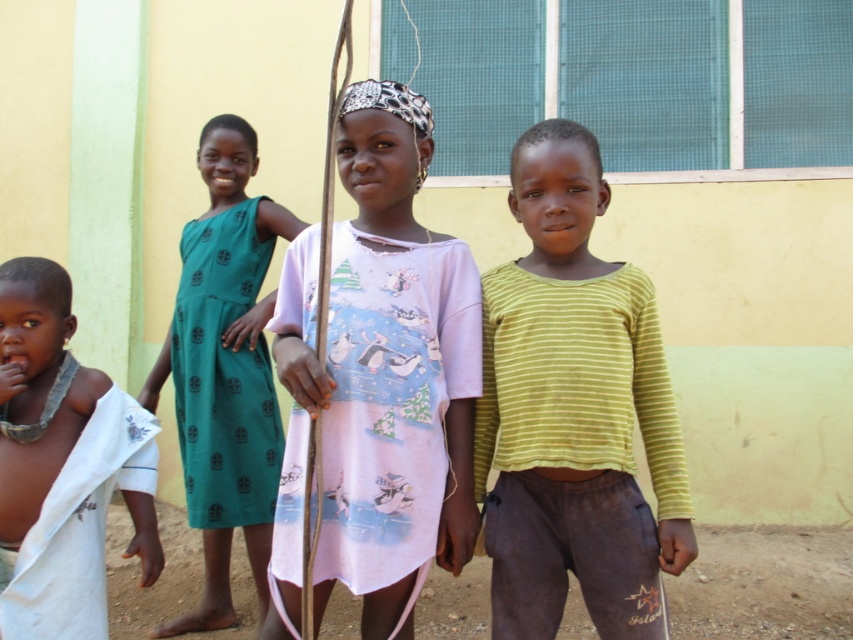
Does green printed dress at left come behind white cloth at left?

Yes, it is.

Does green printed dress at left come in front of white cloth at left?

No.

Is point (206, 140) farther from camera compared to point (65, 572)?

Yes.

You are a GUI agent. You are given a task and a screenshot of the screen. Output one action in this format:
    pyautogui.click(x=<x>, y=<y>)
    Task: Click on the green printed dress at left
    This screenshot has width=853, height=640.
    Given the screenshot: What is the action you would take?
    pyautogui.click(x=225, y=371)

Locate an element on the screen. The height and width of the screenshot is (640, 853). yellow-green striped shirt at center is located at coordinates (573, 412).

Which of these two, yellow-green striped shirt at center or white cloth at left, stands taller?

yellow-green striped shirt at center is taller.

Is point (659, 529) less distant than point (85, 547)?

Yes.

Locate an element on the screen. yellow-green striped shirt at center is located at coordinates (573, 412).

Is point (318, 236) farther from viewer compared to point (193, 506)?

That is False.

Measure the distance between point [338,320] and camera.

A distance of 2.65 meters exists between point [338,320] and camera.

At what (x,y) coordinates should I click in order to perform the action: click on pink cotton dress at center. Please return your answer as a coordinate pair (x, y). The image size is (853, 640). Looking at the image, I should click on (378, 378).

The height and width of the screenshot is (640, 853). Identify the location of pink cotton dress at center. (378, 378).